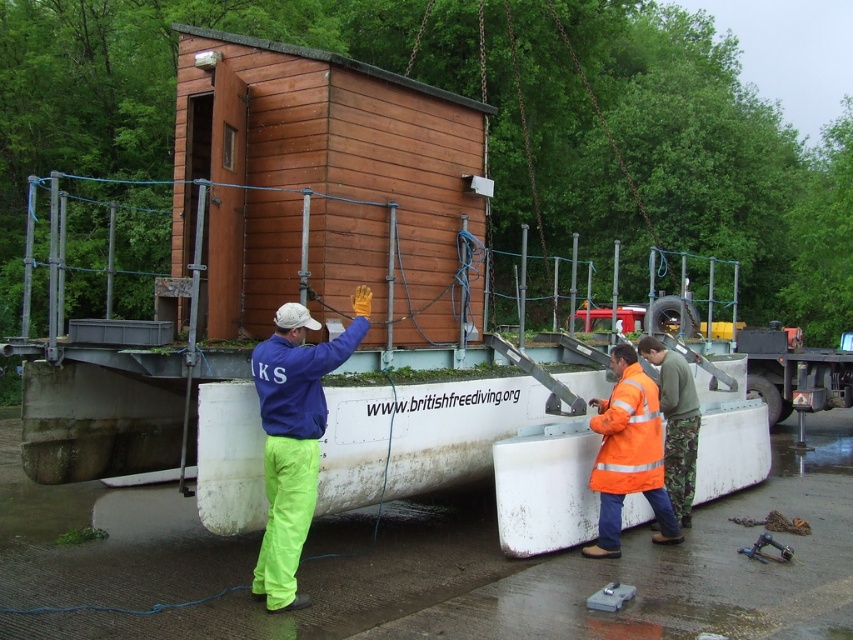
From the picture: You are a drone operator trying to capture a photo of the crane lifting the cabin. To ensure safety, you need to avoid flying over any people. Based on the scene, which direction should you fly the drone to avoid the neon green pants at center?

The neon green pants at center is located at point (294, 436). To avoid flying over them, the drone should be directed away from this coordinate, either north, south, east, or west depending on the specific layout, but the exact direction requires knowing the coordinate system. Since the coordinate system isn